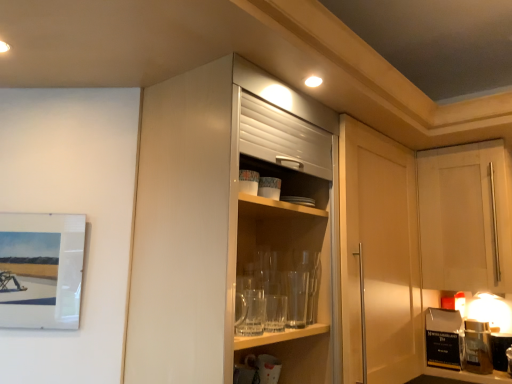
What is the approximate width of white matte cabinet at upper right, which appears as the first cabinetry when viewed from the right?

The width of white matte cabinet at upper right, which appears as the first cabinetry when viewed from the right, is 38.59 centimeters.

The height and width of the screenshot is (384, 512). I want to click on white matte cabinet at upper right, the first cabinetry viewed from the back, so click(465, 218).

From the image's perspective, which one is positioned lower, white matte cabinet at upper right, which appears as the first cabinetry when viewed from the right, or matte white picture frame at left?

From the image's view, matte white picture frame at left is below.

Can you tell me how much white matte cabinet at upper right, the first cabinetry viewed from the back, and matte white picture frame at left differ in facing direction?

The angle between the facing direction of white matte cabinet at upper right, the first cabinetry viewed from the back, and the facing direction of matte white picture frame at left is 38.1 degrees.

From a real-world perspective, between white matte cabinet at upper right, acting as the 2th cabinetry starting from the front, and matte white picture frame at left, who is vertically lower?

matte white picture frame at left.

Which of these two, white matte cabinet at upper right, the second cabinetry from the left, or matte white picture frame at left, is smaller?

matte white picture frame at left.

Is glossy white cabinet at center, acting as the second cabinetry starting from the right, inside matte white picture frame at left?

Actually, glossy white cabinet at center, acting as the second cabinetry starting from the right, is outside matte white picture frame at left.

The image size is (512, 384). I want to click on picture frame below the glossy white cabinet at center, acting as the second cabinetry starting from the right (from the image's perspective), so click(x=41, y=270).

Between matte white picture frame at left and glossy white cabinet at center, the second cabinetry in the back-to-front sequence, which one is positioned behind?

Positioned behind is matte white picture frame at left.

Looking at their sizes, would you say matte white picture frame at left is wider or thinner than glossy white cabinet at center, the 1th cabinetry positioned from the left?

Considering their sizes, matte white picture frame at left looks slimmer than glossy white cabinet at center, the 1th cabinetry positioned from the left.

The height and width of the screenshot is (384, 512). I want to click on cabinetry behind the glossy white cabinet at center, the second cabinetry in the back-to-front sequence, so click(x=465, y=218).

Looking at this image, who is taller, white matte cabinet at upper right, acting as the 2th cabinetry starting from the front, or glossy white cabinet at center, which ranks as the first cabinetry in front-to-back order?

glossy white cabinet at center, which ranks as the first cabinetry in front-to-back order.

From a real-world perspective, is white matte cabinet at upper right, the first cabinetry viewed from the back, located higher than glossy white cabinet at center, the 1th cabinetry positioned from the left?

Yes, from a real-world perspective, white matte cabinet at upper right, the first cabinetry viewed from the back, is on top of glossy white cabinet at center, the 1th cabinetry positioned from the left.

Does white matte cabinet at upper right, the first cabinetry viewed from the back, turn towards glossy white cabinet at center, which ranks as the first cabinetry in front-to-back order?

Yes, white matte cabinet at upper right, the first cabinetry viewed from the back, is turned towards glossy white cabinet at center, which ranks as the first cabinetry in front-to-back order.

Who is smaller, glossy white cabinet at center, the 1th cabinetry positioned from the left, or matte white picture frame at left?

matte white picture frame at left is smaller.

How different are the orientations of glossy white cabinet at center, the 1th cabinetry positioned from the left, and matte white picture frame at left in degrees?

They differ by 50.7 degrees in their facing directions.

Find the location of a particular element. The image size is (512, 384). picture frame behind the glossy white cabinet at center, acting as the second cabinetry starting from the right is located at coordinates (41, 270).

Is glossy white cabinet at center, which ranks as the first cabinetry in front-to-back order, next to matte white picture frame at left?

They are not placed beside each other.

Based on the photo, which of these two, glossy white cabinet at center, the 1th cabinetry positioned from the left, or white matte cabinet at upper right, the second cabinetry from the left, is bigger?

glossy white cabinet at center, the 1th cabinetry positioned from the left, is bigger.

Considering the positions of points (327, 263) and (444, 286), is point (327, 263) closer to camera compared to point (444, 286)?

Yes, it is in front of point (444, 286).

Is glossy white cabinet at center, acting as the second cabinetry starting from the right, further to camera compared to white matte cabinet at upper right, acting as the 2th cabinetry starting from the front?

No, glossy white cabinet at center, acting as the second cabinetry starting from the right, is closer to the viewer.

Considering the relative sizes of glossy white cabinet at center, the second cabinetry in the back-to-front sequence, and white matte cabinet at upper right, the first cabinetry viewed from the back, in the image provided, is glossy white cabinet at center, the second cabinetry in the back-to-front sequence, wider than white matte cabinet at upper right, the first cabinetry viewed from the back,?

Incorrect, the width of glossy white cabinet at center, the second cabinetry in the back-to-front sequence, does not surpass that of white matte cabinet at upper right, the first cabinetry viewed from the back.

Which is more to the right, matte white picture frame at left or white matte cabinet at upper right, which appears as the first cabinetry when viewed from the right?

white matte cabinet at upper right, which appears as the first cabinetry when viewed from the right, is more to the right.

Considering the sizes of matte white picture frame at left and white matte cabinet at upper right, the first cabinetry viewed from the back, in the image, is matte white picture frame at left wider or thinner than white matte cabinet at upper right, the first cabinetry viewed from the back,?

In the image, matte white picture frame at left appears to be more narrow than white matte cabinet at upper right, the first cabinetry viewed from the back.

Which of these two, matte white picture frame at left or white matte cabinet at upper right, the first cabinetry viewed from the back, stands shorter?

With less height is matte white picture frame at left.

From the picture: Can you tell me how much matte white picture frame at left and white matte cabinet at upper right, the first cabinetry viewed from the back, differ in facing direction?

The angle between the facing direction of matte white picture frame at left and the facing direction of white matte cabinet at upper right, the first cabinetry viewed from the back, is 38.1 degrees.

From the image's perspective, count 2nd cabinetrys upward from the matte white picture frame at left and point to it. Please provide its 2D coordinates.

[(465, 218)]

I want to click on picture frame below the glossy white cabinet at center, acting as the second cabinetry starting from the right (from a real-world perspective), so click(41, 270).

From the image, which object appears to be farther from glossy white cabinet at center, the second cabinetry in the back-to-front sequence, matte white picture frame at left or white matte cabinet at upper right, the second cabinetry from the left?

white matte cabinet at upper right, the second cabinetry from the left.

Based on their spatial positions, is glossy white cabinet at center, the 1th cabinetry positioned from the left, or white matte cabinet at upper right, the first cabinetry viewed from the back, closer to matte white picture frame at left?

The object closer to matte white picture frame at left is glossy white cabinet at center, the 1th cabinetry positioned from the left.

Estimate the real-world distances between objects in this image. Which object is further from glossy white cabinet at center, which ranks as the first cabinetry in front-to-back order, white matte cabinet at upper right, the first cabinetry viewed from the back, or matte white picture frame at left?

white matte cabinet at upper right, the first cabinetry viewed from the back, is further to glossy white cabinet at center, which ranks as the first cabinetry in front-to-back order.

Looking at the image, which one is located closer to white matte cabinet at upper right, the second cabinetry from the left, glossy white cabinet at center, acting as the second cabinetry starting from the right, or matte white picture frame at left?

glossy white cabinet at center, acting as the second cabinetry starting from the right, is positioned closer to the anchor white matte cabinet at upper right, the second cabinetry from the left.

Considering their positions, is matte white picture frame at left positioned closer to white matte cabinet at upper right, acting as the 2th cabinetry starting from the front, than glossy white cabinet at center, the 1th cabinetry positioned from the left?

glossy white cabinet at center, the 1th cabinetry positioned from the left.

Based on their spatial positions, is white matte cabinet at upper right, acting as the 2th cabinetry starting from the front, or glossy white cabinet at center, the 1th cabinetry positioned from the left, further from matte white picture frame at left?

white matte cabinet at upper right, acting as the 2th cabinetry starting from the front, lies further to matte white picture frame at left than the other object.

Identify the location of cabinetry between matte white picture frame at left and white matte cabinet at upper right, acting as the 2th cabinetry starting from the front, in the horizontal direction. (231, 226).